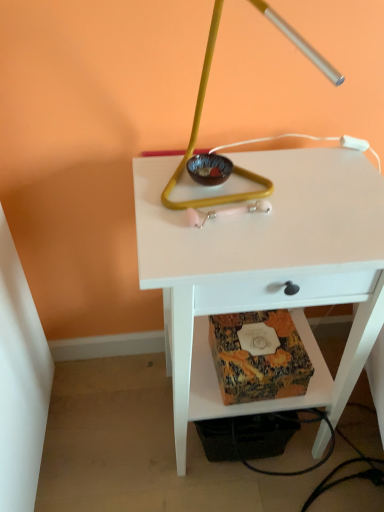
Image resolution: width=384 pixels, height=512 pixels. What are the coordinates of `blank space to the left of matte brown glass bowl at center` in the screenshot? It's located at (157, 181).